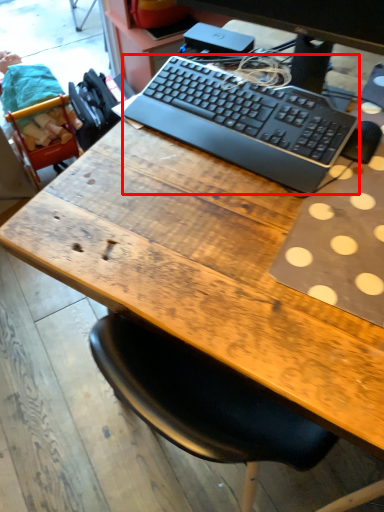
Question: Observing the image, what is the correct spatial positioning of computer keyboard (annotated by the red box) in reference to computer monitor?

Choices:
 (A) right
 (B) left

Answer: (B)